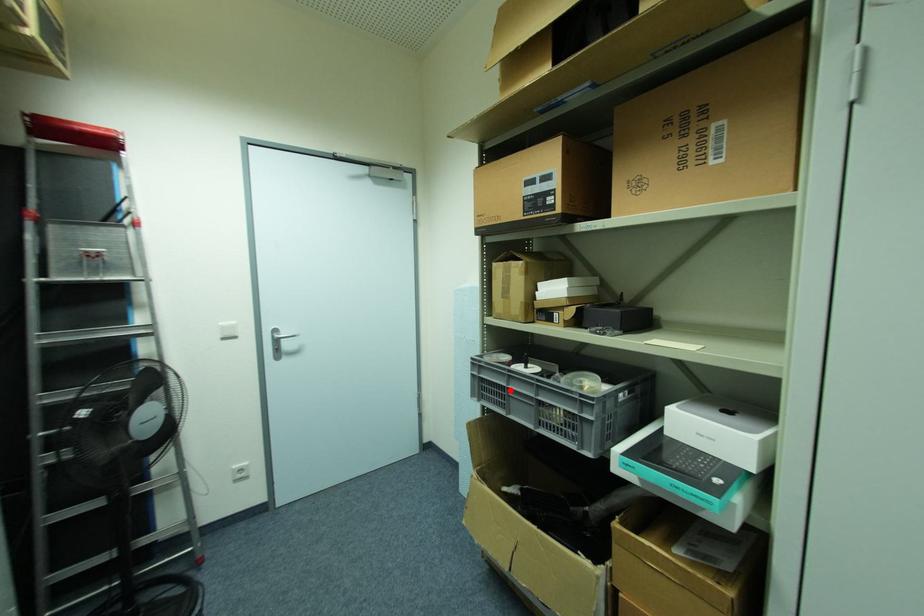
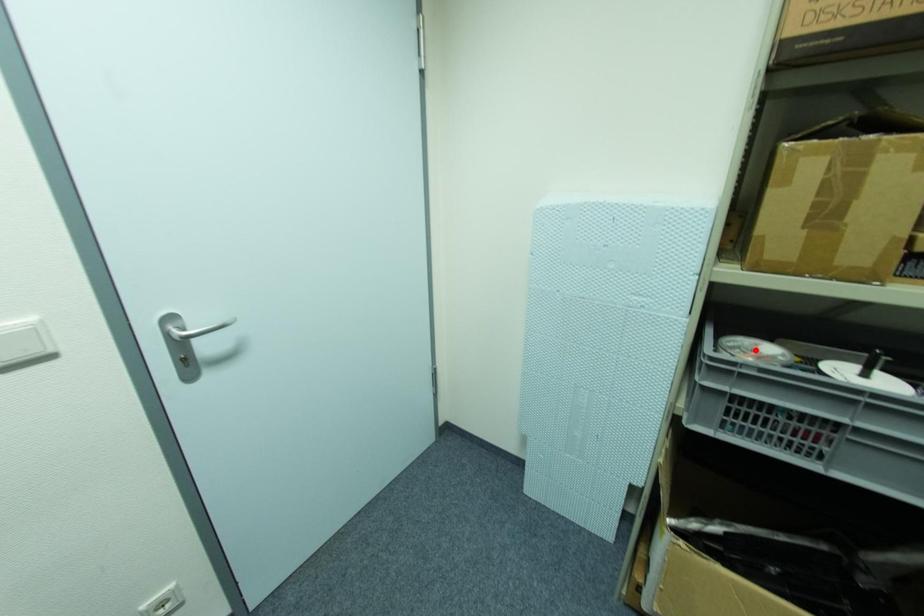
I am providing you with two images of the same scene from different viewpoints. A red point is marked on the first image and another point is marked on the second image. Are the points marked in image1 and image2 representing the same 3D position?

No